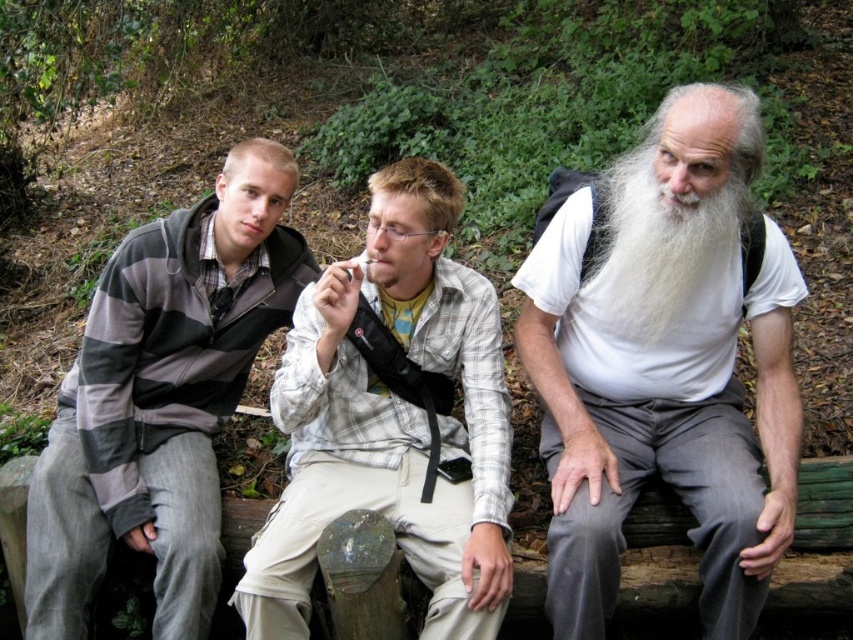
You are trying to take a photo of the group while avoiding capturing the white matte beard at center. Based on the scene description, where should you position yourself relative to the group to ensure the beard is not in the frame?

To avoid capturing the white matte beard at center, position yourself such that the beard is outside the camera frame. Since the beard is located at point (665,365), adjusting your angle or distance can exclude it from the shot.